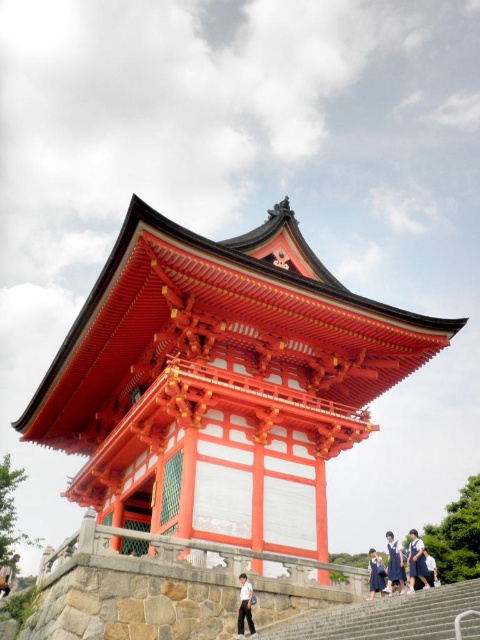
You are standing at the base of the structure and want to reach the entrance. Where are the gray stone stairs at lower center located in relation to your current position?

The gray stone stairs at lower center are located at point (384, 616), which is the lower center position relative to your current standing point at the base.

You are standing at the base of the shiny lacquered pagoda at center and want to see the blue school uniform at lower center. Which direction should you look?

The shiny lacquered pagoda at center is above the blue school uniform at lower center, so you should look downward to see the blue school uniform at lower center.

You are standing at the base of the shiny lacquered pagoda at center and want to take a photo of it. However, there is someone wearing white uniform pants at lower center in the way. Based on their positions, can you move to the side to get a clear shot of the pagoda without the person blocking it?

The shiny lacquered pagoda at center is located above the white uniform pants at lower center, so moving to the side horizontally should allow you to position yourself around the person and capture the pagoda without obstruction.